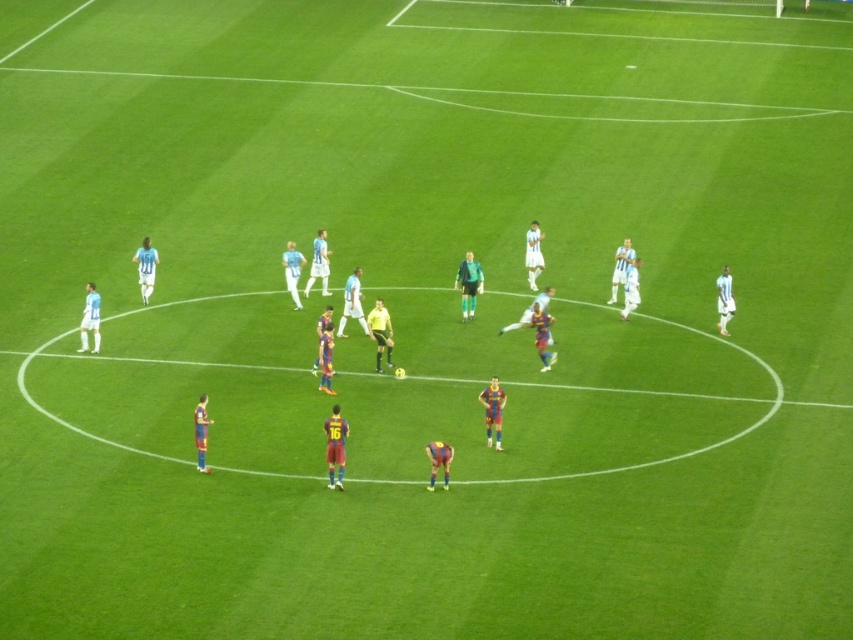
Who is positioned more to the left, white jersey at center or white matte jersey at center?

white jersey at center

Does white jersey at center appear on the left side of white matte jersey at center?

Correct, you'll find white jersey at center to the left of white matte jersey at center.

Is point (310, 268) more distant than point (531, 260)?

Yes, it is.

Where is `white jersey at center`? white jersey at center is located at coordinates (318, 262).

Can you confirm if green jersey at center is taller than blue jersey at center?

Yes.

Does green jersey at center appear under blue jersey at center?

Actually, green jersey at center is above blue jersey at center.

This screenshot has width=853, height=640. What do you see at coordinates (468, 284) in the screenshot? I see `green jersey at center` at bounding box center [468, 284].

Identify the location of green jersey at center. (468, 284).

Is point (344, 324) closer to camera compared to point (325, 257)?

Yes.

Which is in front, point (351, 275) or point (318, 275)?

Point (351, 275) is more forward.

Find the location of a particular element. Image resolution: width=853 pixels, height=640 pixels. blue jersey at center is located at coordinates (352, 304).